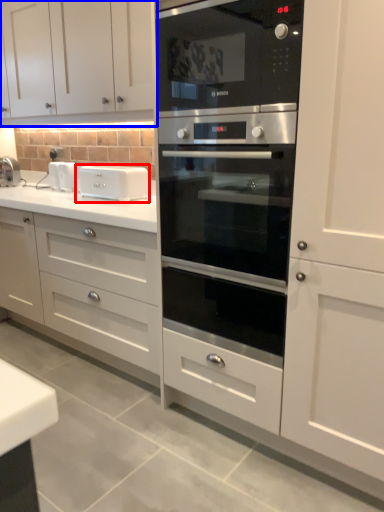
Question: Which object appears farthest to the camera in this image, appliance (highlighted by a red box) or cabinetry (highlighted by a blue box)?

Choices:
 (A) appliance
 (B) cabinetry

Answer: (A)